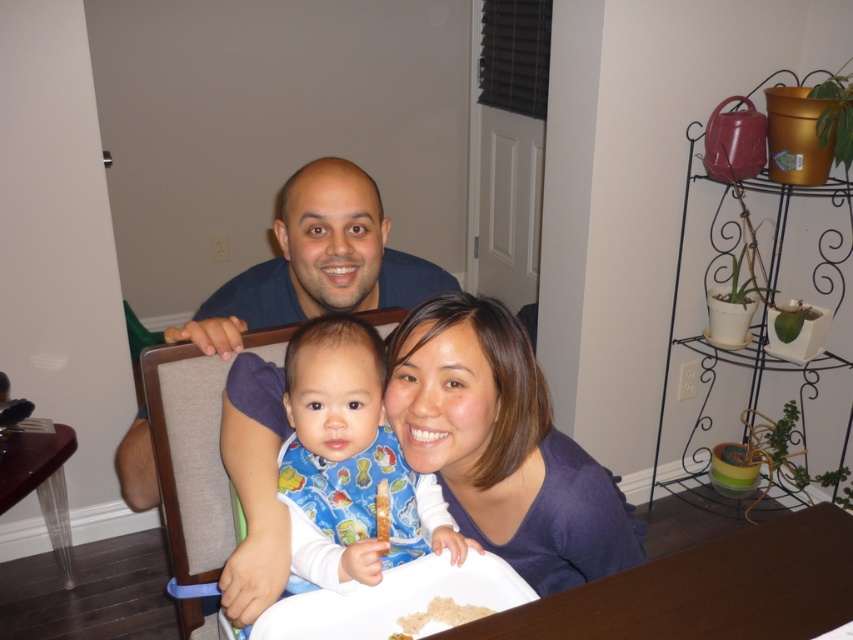
You are a photographer trying to capture a closeup of the brown crumbly rice at lower center without the purple matte shirt at center blocking the view. Is this possible given their positions?

The purple matte shirt at center is in front of brown crumbly rice at lower center, so it would block the view. To capture the brown crumbly rice at lower center without obstruction, you would need to adjust your angle or move the purple matte shirt at center out of the way.